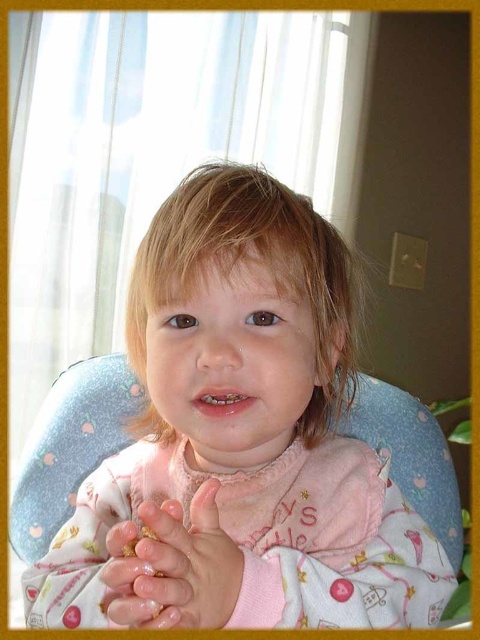
Question: Which point is farther to the camera?

Choices:
 (A) (226, 445)
 (B) (182, 541)

Answer: (A)

Question: Observing the image, what is the correct spatial positioning of pink fabric bib at center in reference to smooth skin hands at center?

Choices:
 (A) below
 (B) above

Answer: (B)

Question: Does pink fabric bib at center appear over smooth skin hands at center?

Choices:
 (A) no
 (B) yes

Answer: (B)

Question: Does pink fabric bib at center appear over smooth skin hands at center?

Choices:
 (A) no
 (B) yes

Answer: (B)

Question: Which point appears closest to the camera in this image?

Choices:
 (A) (160, 604)
 (B) (301, 202)

Answer: (A)